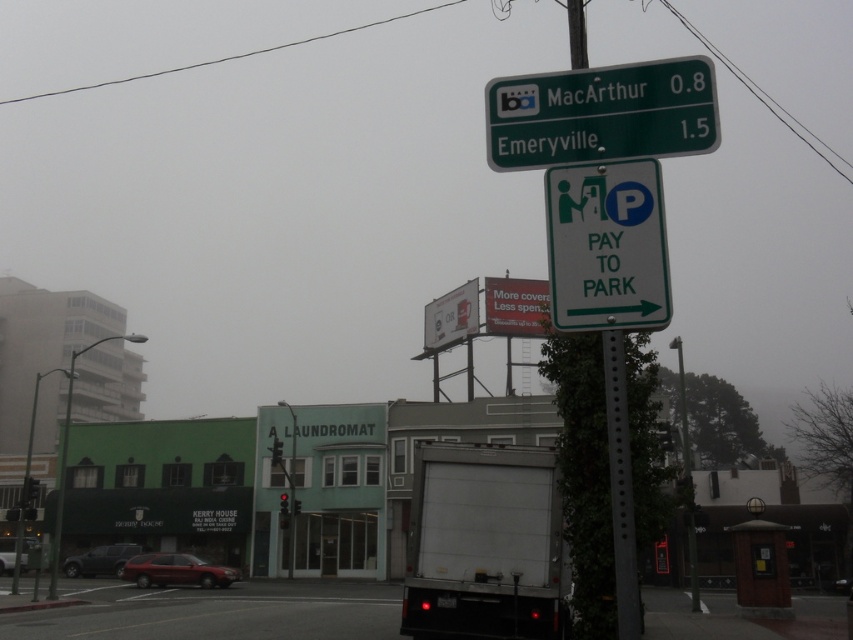
You are standing on the sidewalk and see the white matte truck at lower center and the green metallic street sign at upper center. Which object is positioned to the left of the other?

The white matte truck at lower center is positioned to the left of the green metallic street sign at upper center.

You are a driver looking for parking. You see the white matte truck at lower center and the green metallic street sign at upper center. Which object would appear closer to you from your perspective?

The white matte truck at lower center appears closer because it is smaller in size compared to the green metallic street sign at upper center. In perspective, smaller objects can sometimes appear farther away, but in this case, the truck is positioned lower and central, suggesting it is nearer to the viewer while the street sign is higher up and likely farther away.